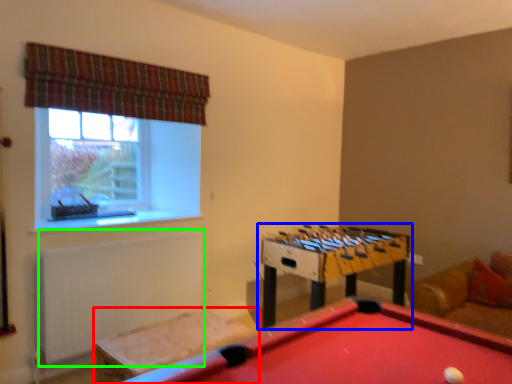
Question: Which object is the closest to the furniture (highlighted by a red box)? Choose among these: table (highlighted by a blue box) or radiator (highlighted by a green box).

Choices:
 (A) table
 (B) radiator

Answer: (B)